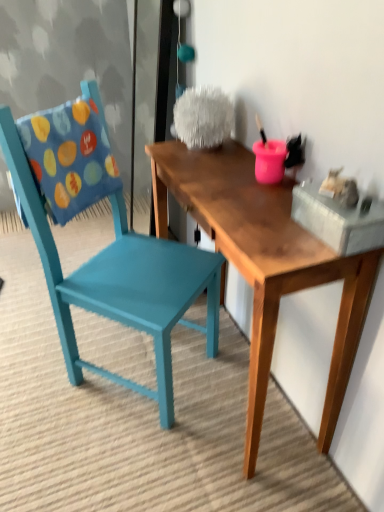
This screenshot has height=512, width=384. In order to click on free space that is to the left of wooden table at center in this screenshot , I will do `click(61, 411)`.